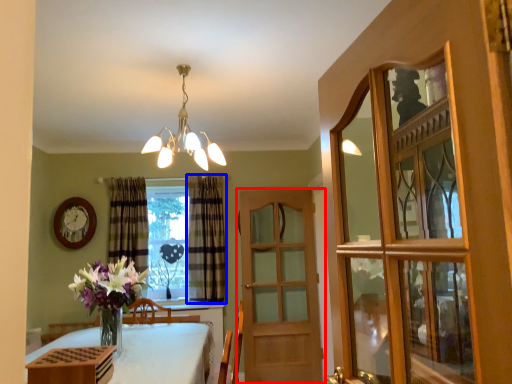
Question: Which object is closer to the camera taking this photo, door (highlighted by a red box) or curtain (highlighted by a blue box)?

Choices:
 (A) door
 (B) curtain

Answer: (A)